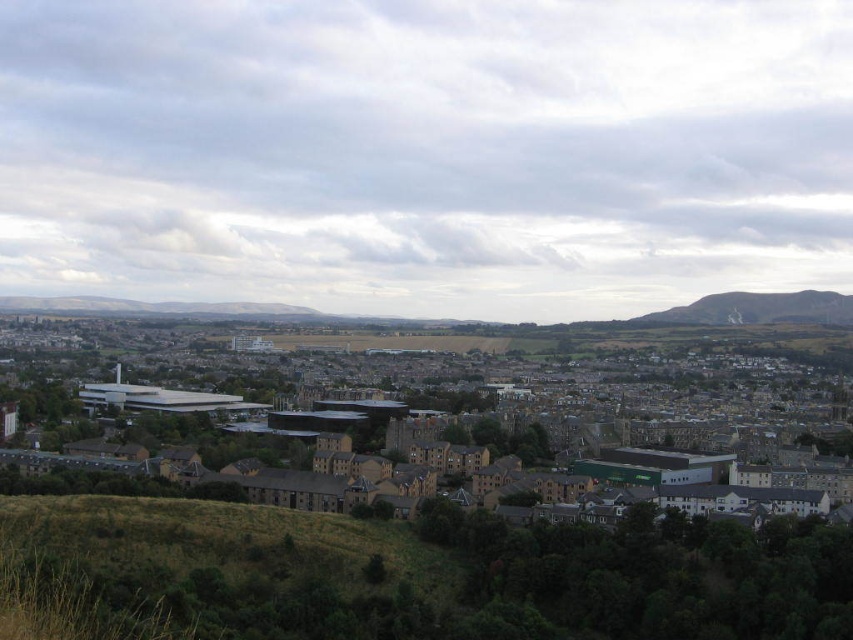
Can you confirm if brown stone buildings at center is thinner than green grassy hill at right?

In fact, brown stone buildings at center might be wider than green grassy hill at right.

Which of these two, brown stone buildings at center or green grassy hill at right, stands taller?

Standing taller between the two is brown stone buildings at center.

At what (x,y) coordinates should I click in order to perform the action: click on brown stone buildings at center. Please return your answer as a coordinate pair (x, y). Image resolution: width=853 pixels, height=640 pixels. Looking at the image, I should click on (497, 419).